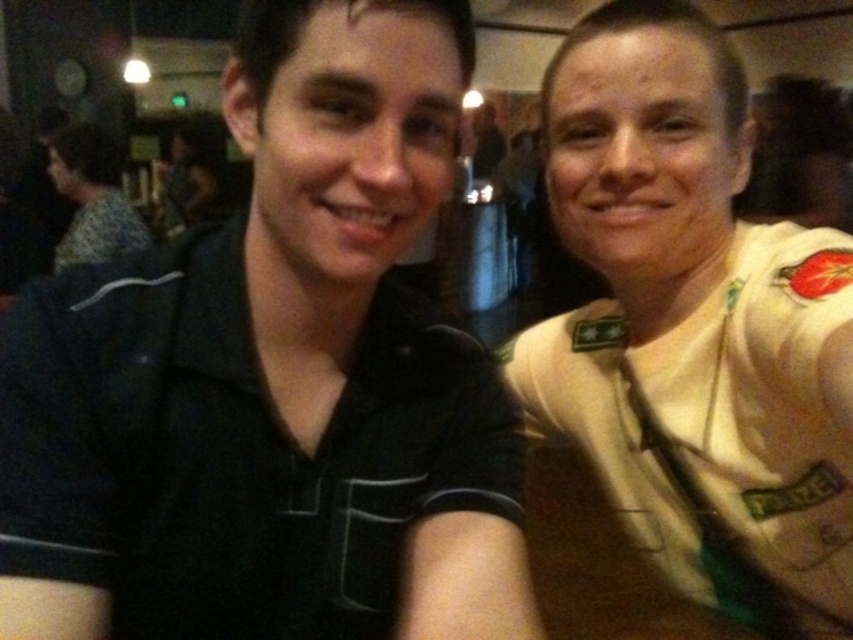
Question: Does black matte shirt at center come in front of white uniform shirt at right?

Choices:
 (A) no
 (B) yes

Answer: (B)

Question: Which point appears closest to the camera in this image?

Choices:
 (A) (556, 426)
 (B) (428, 426)
 (C) (94, 182)

Answer: (B)

Question: Is black matte shirt at center wider than matte black shirt at left?

Choices:
 (A) no
 (B) yes

Answer: (A)

Question: Can you confirm if black matte shirt at center is positioned below matte black shirt at left?

Choices:
 (A) no
 (B) yes

Answer: (B)

Question: Which is nearer to the black matte shirt at center?

Choices:
 (A) matte black shirt at left
 (B) white uniform shirt at right

Answer: (B)

Question: Among these objects, which one is farthest from the camera?

Choices:
 (A) black matte shirt at center
 (B) white uniform shirt at right

Answer: (B)